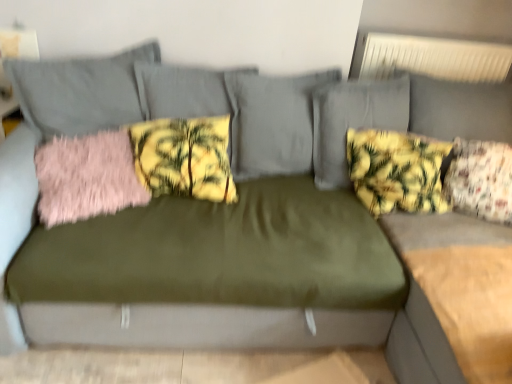
Question: Based on their positions, is yellow floral fabric pillow at upper right, which is the 3th pillow in left-to-right order, located to the left or right of floral fabric pillow at right, which ranks as the first pillow in right-to-left order?

Choices:
 (A) right
 (B) left

Answer: (B)

Question: Considering the positions of yellow floral fabric pillow at upper right, which is the 3th pillow in left-to-right order, and floral fabric pillow at right, the 4th pillow in the left-to-right sequence, in the image, is yellow floral fabric pillow at upper right, which is the 3th pillow in left-to-right order, bigger or smaller than floral fabric pillow at right, the 4th pillow in the left-to-right sequence,?

Choices:
 (A) small
 (B) big

Answer: (B)

Question: Considering the real-world distances, which object is farthest from the yellow floral fabric pillow at center, which appears as the second pillow when viewed from the left?

Choices:
 (A) pink fluffy pillow at left, which is counted as the 1th pillow, starting from the left
 (B) floral fabric pillow at right, which ranks as the first pillow in right-to-left order
 (C) yellow floral fabric pillow at upper right, which is the 3th pillow in left-to-right order

Answer: (B)

Question: Estimate the real-world distances between objects in this image. Which object is closer to the pink fluffy pillow at left, which is counted as the 1th pillow, starting from the left?

Choices:
 (A) floral fabric pillow at right, the 4th pillow in the left-to-right sequence
 (B) yellow floral fabric pillow at upper right, which is the 2th pillow from right to left
 (C) yellow floral fabric pillow at center, which is the 3th pillow in right-to-left order

Answer: (C)